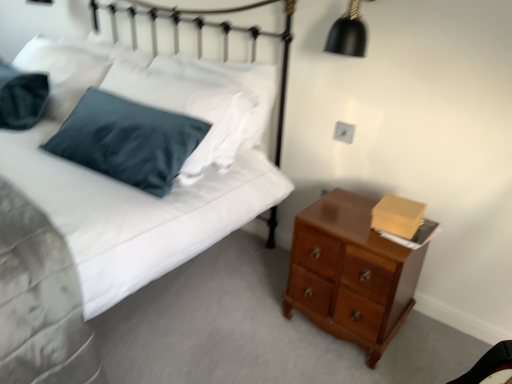
Question: Is satin blue pillow at upper left wider or thinner than glossy wood chest of drawers at lower right?

Choices:
 (A) thin
 (B) wide

Answer: (A)

Question: Is satin blue pillow at upper left bigger or smaller than glossy wood chest of drawers at lower right?

Choices:
 (A) small
 (B) big

Answer: (B)

Question: Which object is positioned closest to the glossy wood chest of drawers at lower right?

Choices:
 (A) satin blue pillow at upper left
 (B) black matte lampshade at upper right

Answer: (B)

Question: Which object is the closest to the satin blue pillow at upper left?

Choices:
 (A) glossy wood chest of drawers at lower right
 (B) black matte lampshade at upper right

Answer: (B)